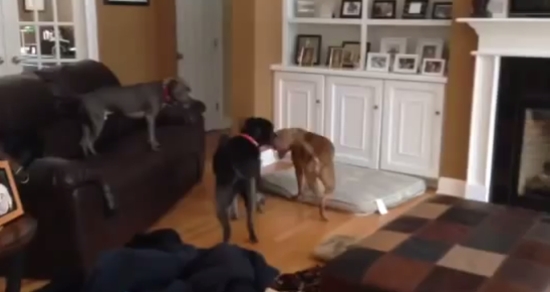
Locate an element on the screen. The width and height of the screenshot is (550, 292). end table is located at coordinates (21, 238).